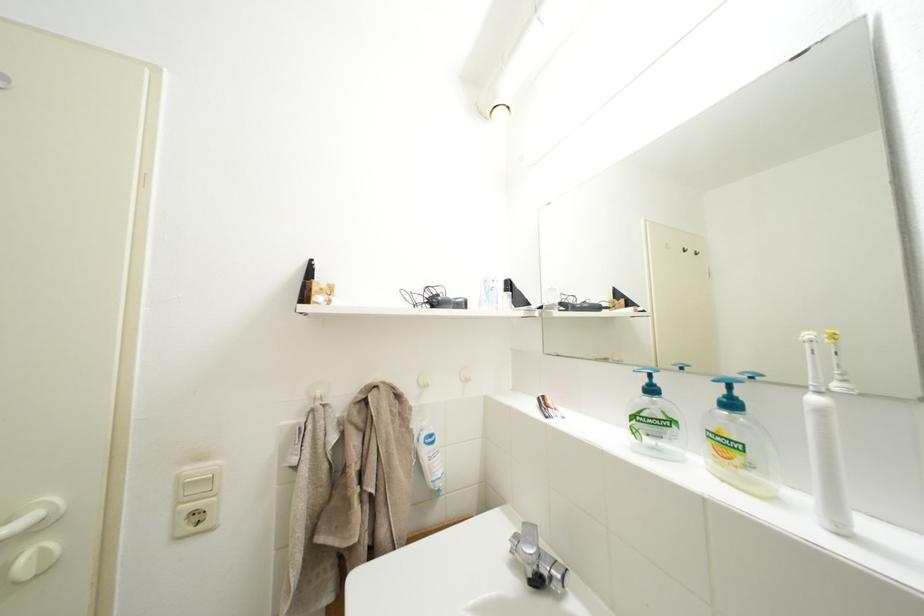
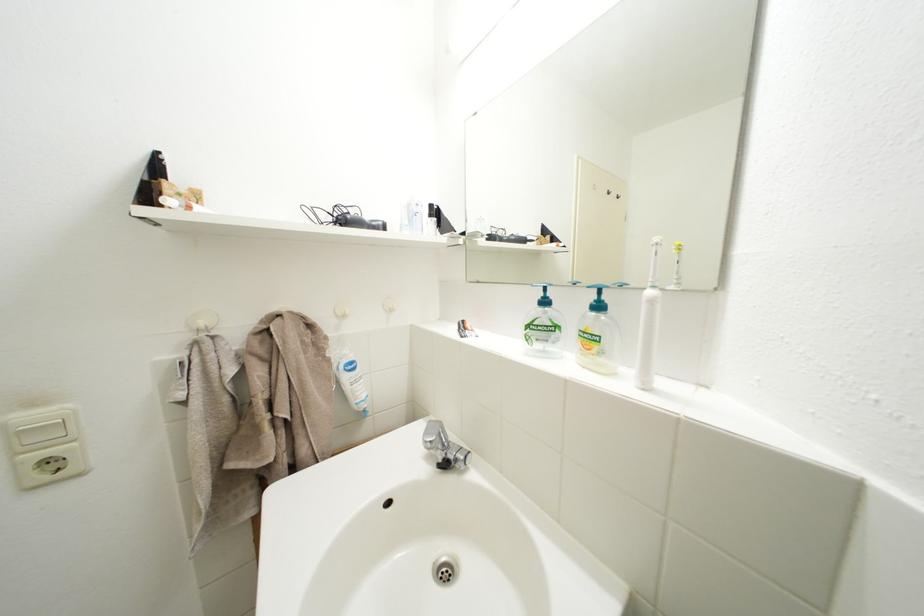
Find the pixel in the second image that matches (823,405) in the first image.

(659, 298)